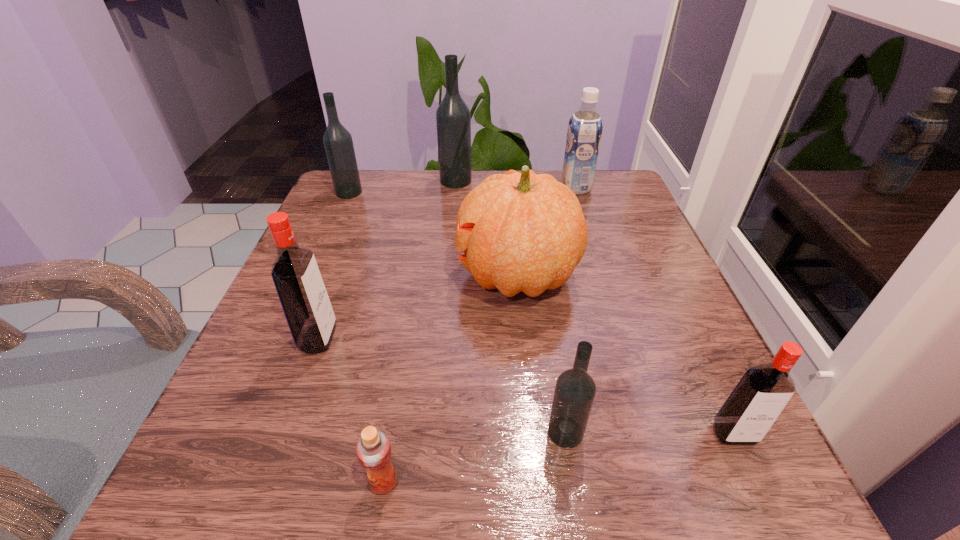
Locate an element on the screen. This screenshot has height=540, width=960. object that is at the far left corner is located at coordinates (338, 143).

Identify the location of object that is positioned at the far right corner. This screenshot has width=960, height=540. (x=585, y=126).

This screenshot has height=540, width=960. In order to click on object that is at the near right corner in this screenshot , I will do `click(762, 393)`.

The width and height of the screenshot is (960, 540). Find the location of `free space at the far edge of the desktop`. free space at the far edge of the desktop is located at coordinates (430, 201).

You are a GUI agent. You are given a task and a screenshot of the screen. Output one action in this format:
    pyautogui.click(x=<x>, y=<y>)
    Task: Click on the vacant position at the near edge of the desktop
    The width and height of the screenshot is (960, 540).
    Given the screenshot: What is the action you would take?
    pyautogui.click(x=422, y=467)

At what (x,y) coordinates should I click in order to perform the action: click on vacant space at the left edge. Please return your answer as a coordinate pair (x, y). The image size is (960, 540). Looking at the image, I should click on (336, 291).

Image resolution: width=960 pixels, height=540 pixels. In order to click on vacant region at the right edge of the desktop in this screenshot , I will do `click(627, 294)`.

In the image, there is a desktop. Where is `vacant space at the far left corner`? The width and height of the screenshot is (960, 540). vacant space at the far left corner is located at coordinates (377, 214).

Where is `vacant space at the near left corner of the desktop`? This screenshot has width=960, height=540. vacant space at the near left corner of the desktop is located at coordinates (236, 491).

The height and width of the screenshot is (540, 960). What are the coordinates of `blank region between the shortest object and the second black vodka from right to left` in the screenshot? It's located at (420, 332).